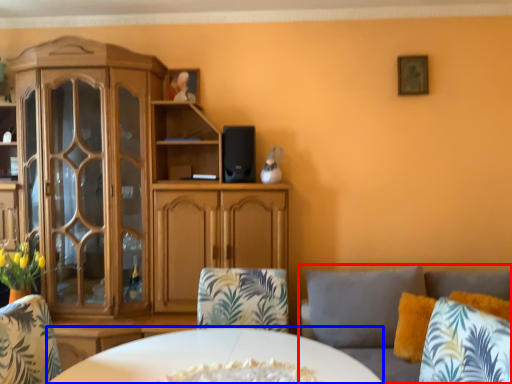
Question: Which of the following is the farthest to the observer, studio couch (highlighted by a red box) or desk (highlighted by a blue box)?

Choices:
 (A) studio couch
 (B) desk

Answer: (B)